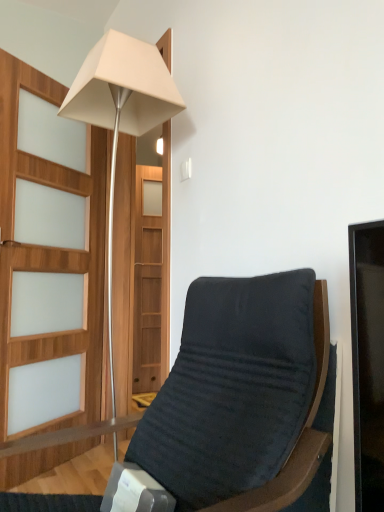
Question: From the image's perspective, is velvet-like dark gray chair at center positioned above or below matte white lamp at upper left?

Choices:
 (A) above
 (B) below

Answer: (B)

Question: Is velvet-like dark gray chair at center in front of or behind matte white lamp at upper left in the image?

Choices:
 (A) front
 (B) behind

Answer: (A)

Question: Considering the positions of velvet-like dark gray chair at center and matte white lamp at upper left in the image, is velvet-like dark gray chair at center wider or thinner than matte white lamp at upper left?

Choices:
 (A) wide
 (B) thin

Answer: (A)

Question: Considering the positions of point (81, 113) and point (226, 376), is point (81, 113) closer or farther from the camera than point (226, 376)?

Choices:
 (A) farther
 (B) closer

Answer: (A)

Question: From a real-world perspective, is matte white lamp at upper left physically located above or below velvet-like dark gray chair at center?

Choices:
 (A) below
 (B) above

Answer: (B)

Question: Considering the relative positions of matte white lamp at upper left and velvet-like dark gray chair at center in the image provided, is matte white lamp at upper left to the left or to the right of velvet-like dark gray chair at center?

Choices:
 (A) right
 (B) left

Answer: (B)

Question: Is matte white lamp at upper left in front of or behind velvet-like dark gray chair at center in the image?

Choices:
 (A) behind
 (B) front

Answer: (A)